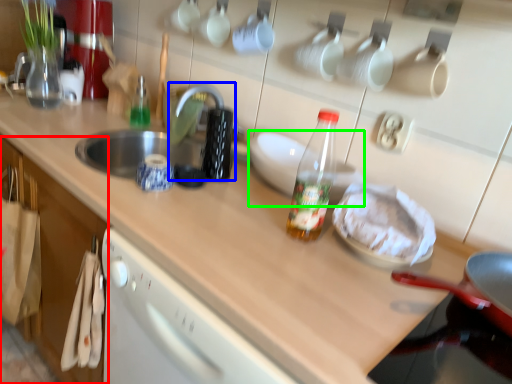
Question: Which is farther away from cabinetry (highlighted by a red box)? faucet (highlighted by a blue box) or appliance (highlighted by a green box)?

Choices:
 (A) faucet
 (B) appliance

Answer: (B)